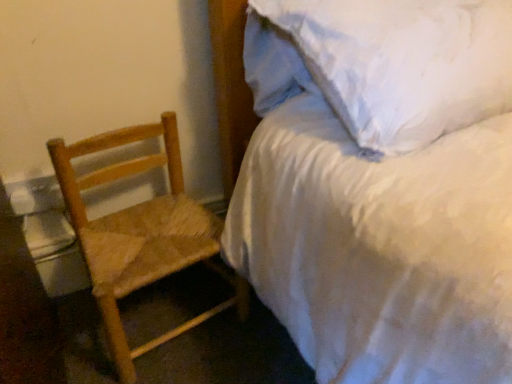
Question: Looking at the image, does white satin bed at upper right seem bigger or smaller compared to natural wood woven chair at left?

Choices:
 (A) small
 (B) big

Answer: (B)

Question: Choose the correct answer: Is white satin bed at upper right inside natural wood woven chair at left or outside it?

Choices:
 (A) outside
 (B) inside

Answer: (A)

Question: Is point (480, 188) positioned closer to the camera than point (117, 213)?

Choices:
 (A) closer
 (B) farther

Answer: (A)

Question: Considering the positions of point (103, 238) and point (282, 105), is point (103, 238) closer or farther from the camera than point (282, 105)?

Choices:
 (A) farther
 (B) closer

Answer: (A)

Question: Which is correct: natural wood woven chair at left is inside white satin bed at upper right, or outside of it?

Choices:
 (A) outside
 (B) inside

Answer: (A)

Question: In terms of size, does natural wood woven chair at left appear bigger or smaller than white satin bed at upper right?

Choices:
 (A) big
 (B) small

Answer: (B)

Question: Would you say natural wood woven chair at left is to the left or to the right of white satin bed at upper right in the picture?

Choices:
 (A) right
 (B) left

Answer: (B)